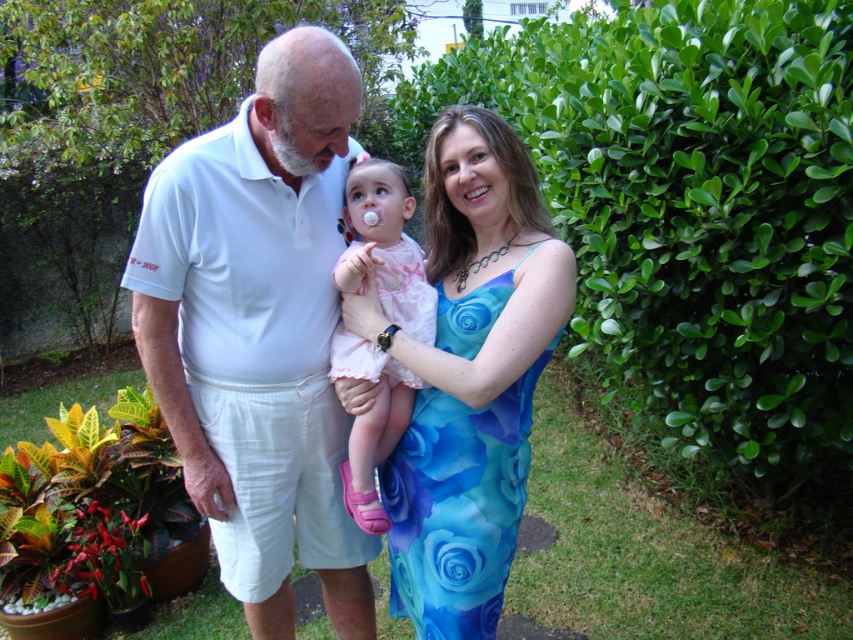
You are a photographer trying to capture a photo of the white cotton shirt at center and the green leafy hedge at center right. Which object is wider in the image?

The green leafy hedge at center right is wider than the white cotton shirt at center.

In the scene shown: You are organizing a clothing display and need to arrange the white cotton shirt at center and the blue floral fabric dress at center side by side. Based on their widths, which one should you place first to ensure they fit within the display area?

The white cotton shirt at center is wider than the blue floral fabric dress at center, so you should place the white cotton shirt at center first to accommodate its greater width.